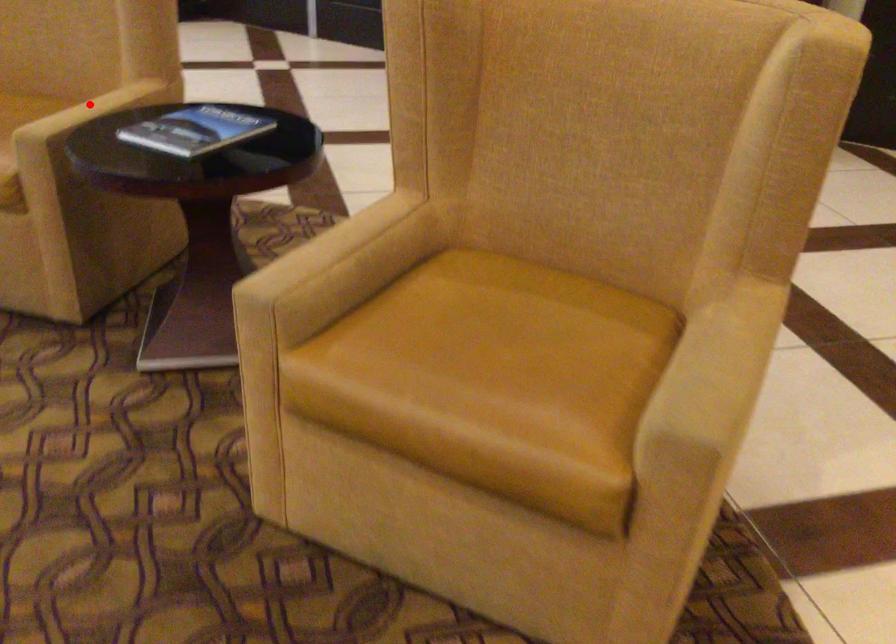
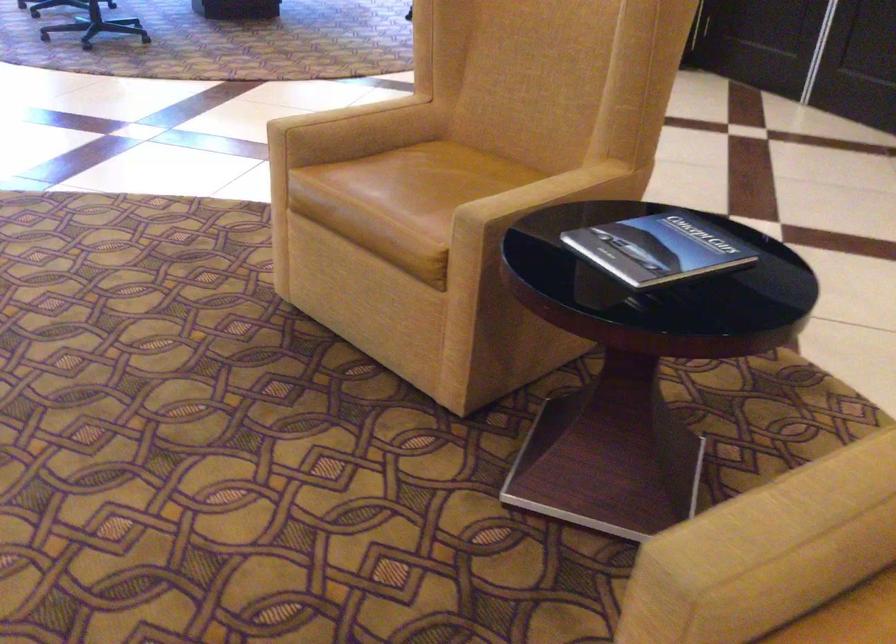
Where in the second image is the point corresponding to the highlighted location from the first image?

(541, 193)